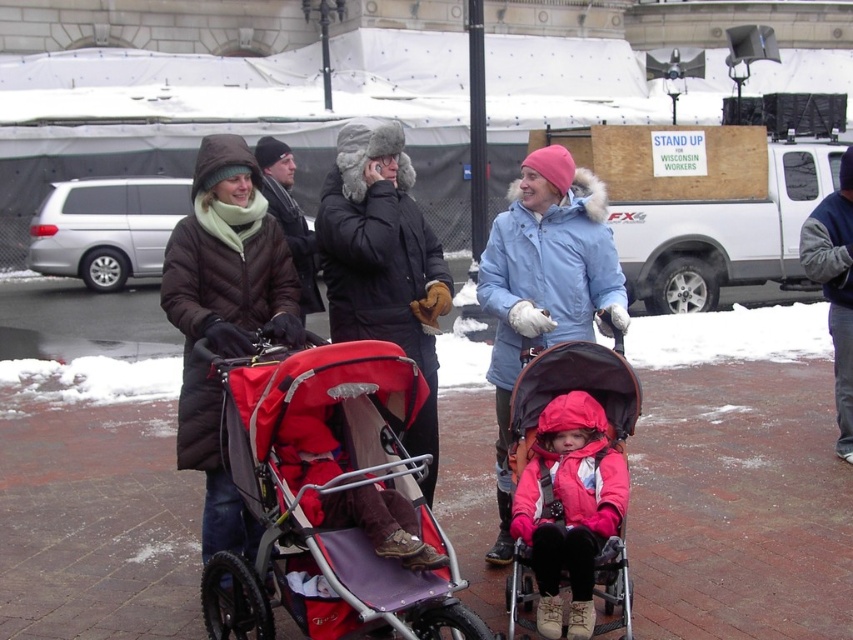
Does point (3, 525) come in front of point (210, 458)?

That is False.

Which is in front, point (665, 522) or point (225, 518)?

Point (225, 518) is in front.

The height and width of the screenshot is (640, 853). What do you see at coordinates (740, 506) in the screenshot? I see `brick pavement at center` at bounding box center [740, 506].

Locate an element on the screen. The height and width of the screenshot is (640, 853). brick pavement at center is located at coordinates (740, 506).

Is matte red stroller at center behind red fabric stroller at center?

Yes, it is.

Which is below, matte red stroller at center or red fabric stroller at center?

red fabric stroller at center is lower down.

Locate an element on the screen. matte red stroller at center is located at coordinates (289, 404).

Does matte red stroller at center have a smaller size compared to matte pink jacket at center?

No, matte red stroller at center is not smaller than matte pink jacket at center.

I want to click on matte red stroller at center, so click(289, 404).